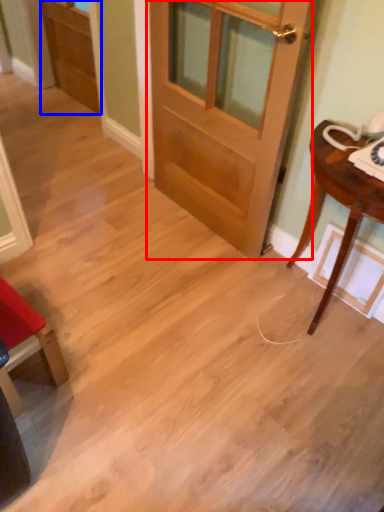
Question: Among these objects, which one is farthest to the camera, door (highlighted by a red box) or screen door (highlighted by a blue box)?

Choices:
 (A) door
 (B) screen door

Answer: (B)